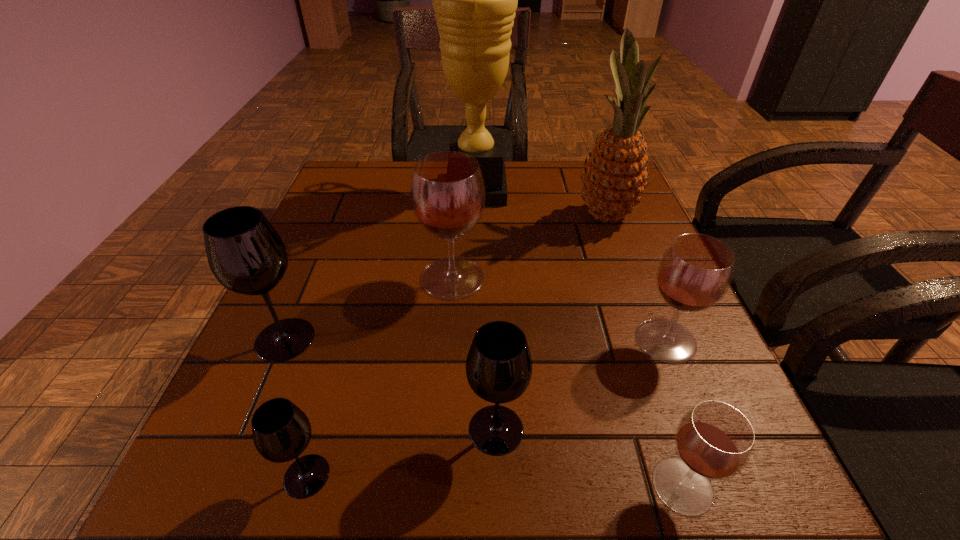
You are a GUI agent. You are given a task and a screenshot of the screen. Output one action in this format:
    pyautogui.click(x=<x>, y=<y>)
    Task: Click on the third closest wineglass to the leftmost red wineglass
    The image size is (960, 540).
    Given the screenshot: What is the action you would take?
    pyautogui.click(x=694, y=273)

Identify which red wineglass is the second closest to the farthest red wineglass. Please provide its 2D coordinates. Your answer should be formatted as a tuple, i.e. [(x, y)], where the tuple contains the x and y coordinates of a point satisfying the conditions above.

[(714, 441)]

Locate which red wineglass ranks second in proximity to the pineapple. Please provide its 2D coordinates. Your answer should be formatted as a tuple, i.e. [(x, y)], where the tuple contains the x and y coordinates of a point satisfying the conditions above.

[(694, 273)]

Identify the location of gray wineglass object that ranks as the second closest to the leftmost object. The width and height of the screenshot is (960, 540). (498, 367).

Select which gray wineglass is the second closest to the pineapple. Please provide its 2D coordinates. Your answer should be formatted as a tuple, i.e. [(x, y)], where the tuple contains the x and y coordinates of a point satisfying the conditions above.

[(245, 253)]

Where is `free location that satisfies the following two spatial constraints: 1. at the front of the pineapple with handles; 2. on the left side of the yellow trophy cup`? The width and height of the screenshot is (960, 540). free location that satisfies the following two spatial constraints: 1. at the front of the pineapple with handles; 2. on the left side of the yellow trophy cup is located at coordinates (476, 215).

Identify the location of free space in the image that satisfies the following two spatial constraints: 1. on the front side of the rightmost gray wineglass; 2. on the left side of the leftmost red wineglass. This screenshot has width=960, height=540. (443, 429).